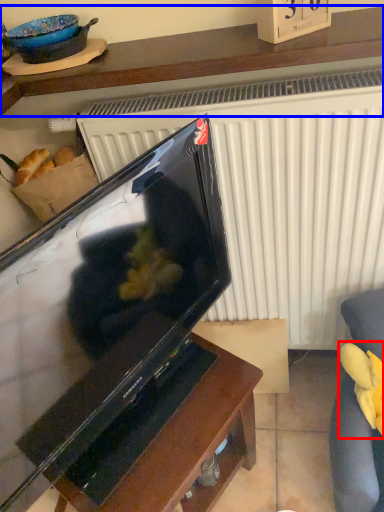
Question: Which object is closer to the camera taking this photo, food (highlighted by a red box) or furniture (highlighted by a blue box)?

Choices:
 (A) food
 (B) furniture

Answer: (B)